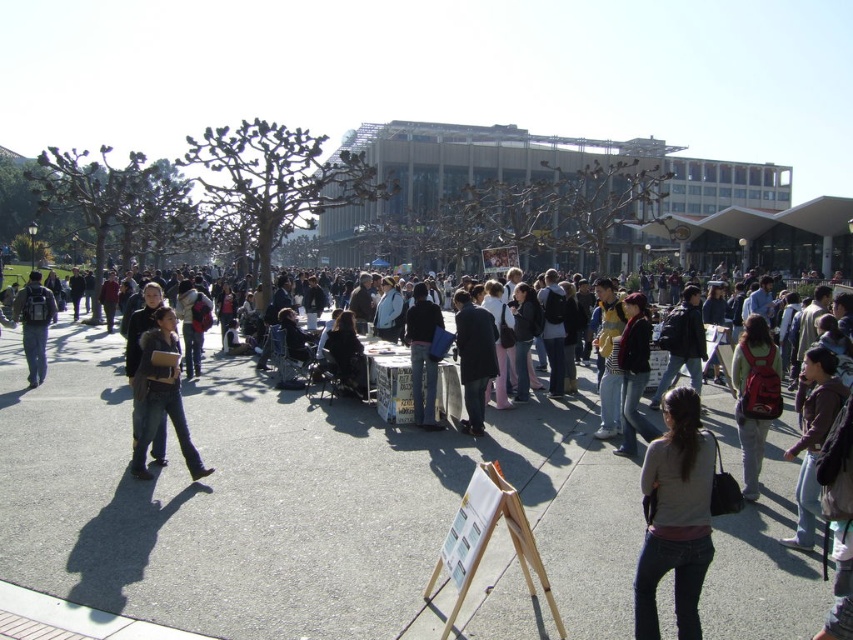
Question: Is dark gray coat at center in front of dark blue jacket at center?

Choices:
 (A) yes
 (B) no

Answer: (A)

Question: Which point appears farthest from the camera in this image?

Choices:
 (A) (422, 365)
 (B) (386, 592)
 (C) (733, 360)

Answer: (A)

Question: Is dark blue jeans at center to the left of matte black backpack at left from the viewer's perspective?

Choices:
 (A) yes
 (B) no

Answer: (B)

Question: Which object is positioned farthest from the matte red backpack at center-right?

Choices:
 (A) dark gray coat at center
 (B) dark brown leather jacket at center
 (C) dark gray jeans at center

Answer: (C)

Question: Is dark blue jeans at center below matte black backpack at left?

Choices:
 (A) yes
 (B) no

Answer: (A)

Question: Estimate the real-world distances between objects in this image. Which object is closer to the dark gray jeans at center?

Choices:
 (A) dark blue jacket at center
 (B) dark brown leather jacket at center
 (C) gray sweater at center
 (D) dark brown leather jacket at lower right

Answer: (C)